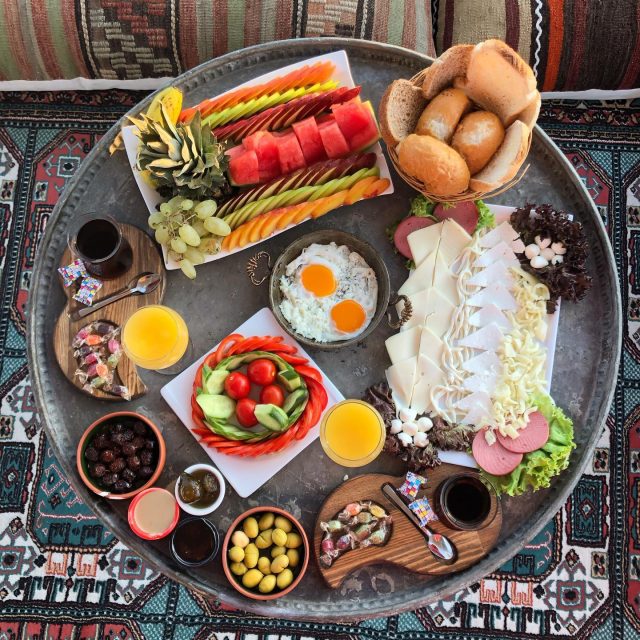
What are the coordinates of `table cloth` in the screenshot? It's located at 59,582.